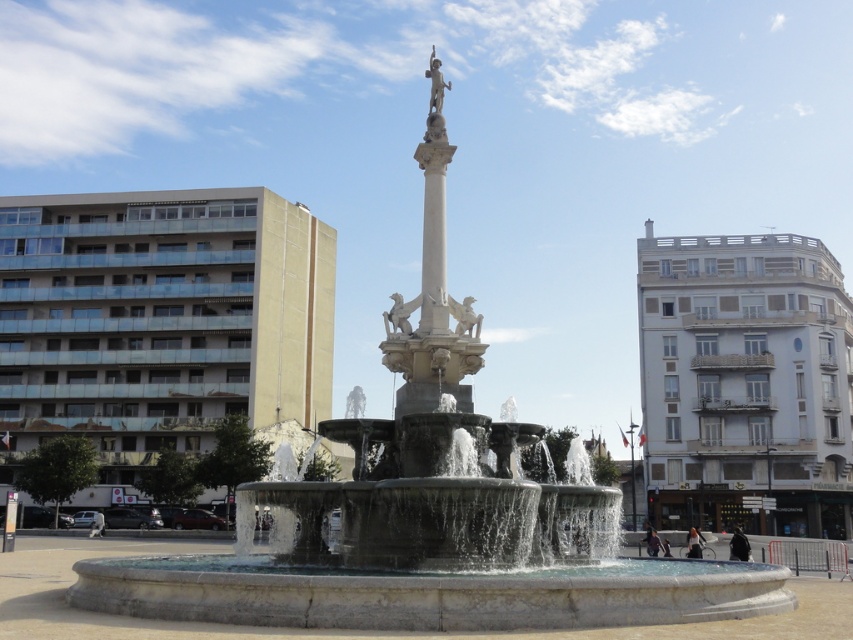
Measure the distance between beige concrete building at left and white marble column at center.

The distance of beige concrete building at left from white marble column at center is 81.95 meters.

Is beige concrete building at left to the right of white marble column at center from the viewer's perspective?

Incorrect, beige concrete building at left is not on the right side of white marble column at center.

Between point (138, 397) and point (473, 348), which one is positioned in front?

Point (473, 348) is more forward.

Identify the location of beige concrete building at left. The image size is (853, 640). (158, 321).

Can you confirm if white concrete building at right is positioned to the left of white marble column at center?

No, white concrete building at right is not to the left of white marble column at center.

Does white concrete building at right appear over white marble column at center?

Incorrect, white concrete building at right is not positioned above white marble column at center.

Between point (715, 404) and point (422, 390), which one is positioned behind?

The point (715, 404) is more distant.

Identify the location of white concrete building at right. (746, 384).

How much distance is there between beige concrete building at left and white concrete building at right?

beige concrete building at left and white concrete building at right are 60.99 meters apart.

Between beige concrete building at left and white concrete building at right, which one has more height?

With more height is white concrete building at right.

Measure the distance between beige concrete building at left and camera.

The distance of beige concrete building at left from camera is 344.04 feet.

The height and width of the screenshot is (640, 853). What are the coordinates of `beige concrete building at left` in the screenshot? It's located at (158, 321).